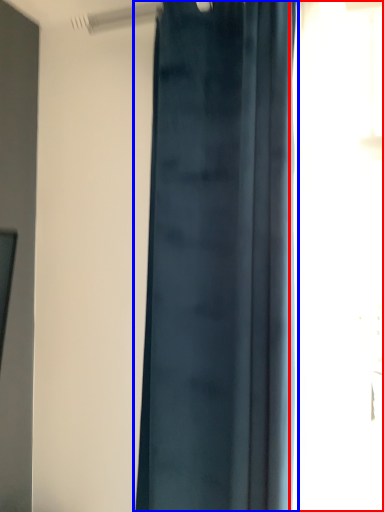
Question: Which object appears farthest to the camera in this image, window (highlighted by a red box) or curtain (highlighted by a blue box)?

Choices:
 (A) window
 (B) curtain

Answer: (B)